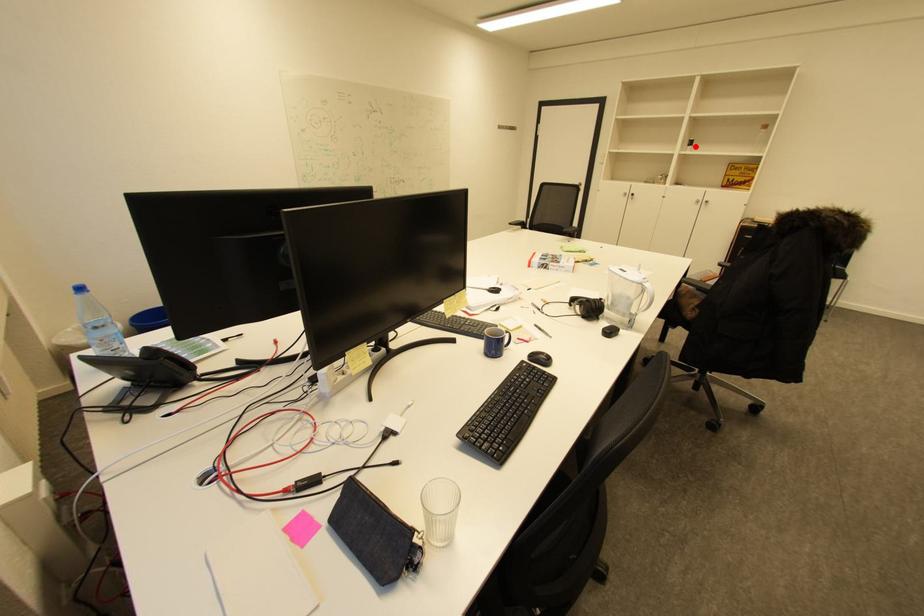
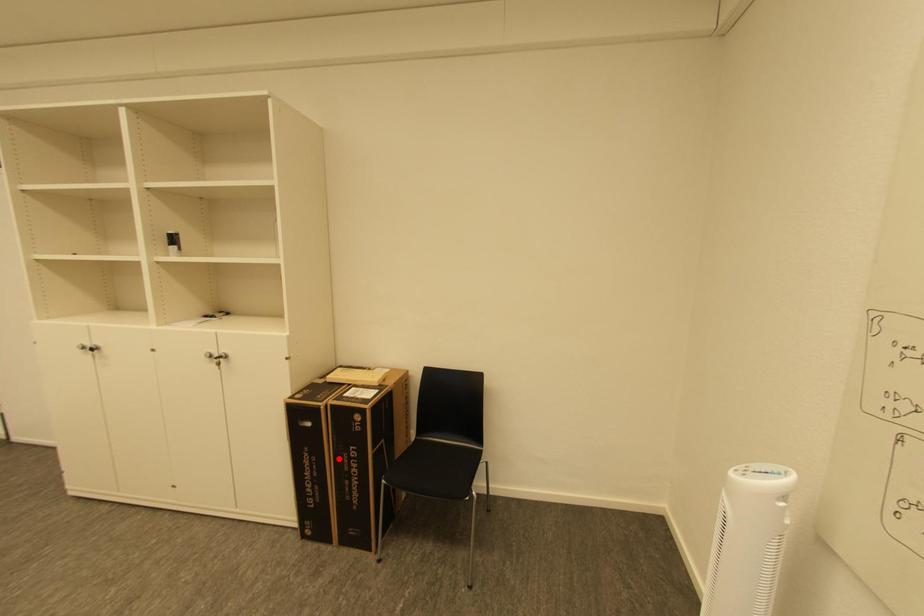
I am providing you with two images of the same scene from different viewpoints. A red point is marked on the first image and another point is marked on the second image. Is the marked point in image1 the same physical position as the marked point in image2?

No